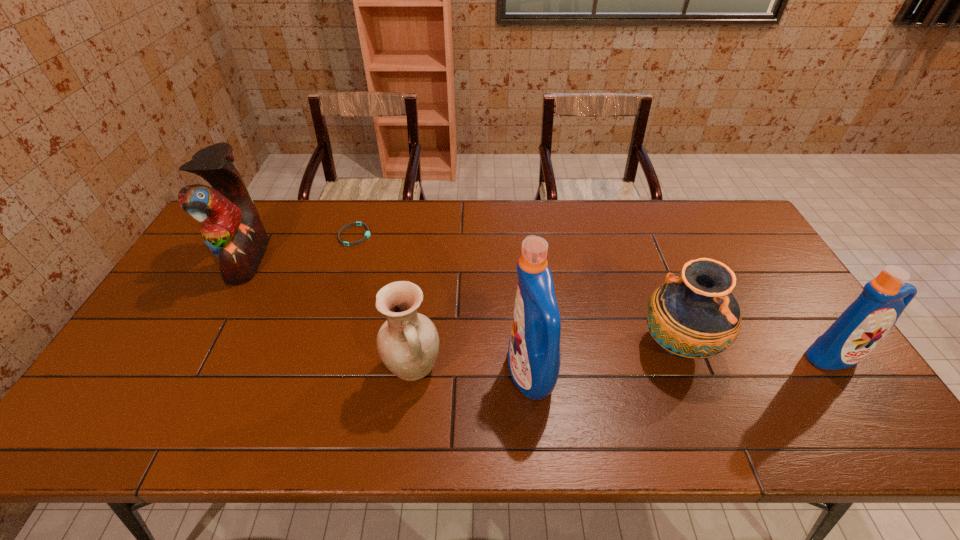
You are a GUI agent. You are given a task and a screenshot of the screen. Output one action in this format:
    pyautogui.click(x=<x>, y=<y>)
    Task: Click on the vacant position located on the label of the fourth object from left to right
    This screenshot has width=960, height=540.
    Given the screenshot: What is the action you would take?
    pyautogui.click(x=375, y=374)

Find the location of a particular element. free location located 0.290m on the label of the fourth object from left to right is located at coordinates (392, 374).

This screenshot has width=960, height=540. What are the coordinates of `free spot located on the label of the shorter detergent` in the screenshot? It's located at [857, 389].

Where is `free region located 0.390m at the face of the leftmost object`? This screenshot has height=540, width=960. free region located 0.390m at the face of the leftmost object is located at coordinates (389, 259).

This screenshot has height=540, width=960. Find the location of `free spot located 0.230m on the buckle of the wristband`. free spot located 0.230m on the buckle of the wristband is located at coordinates (440, 235).

The height and width of the screenshot is (540, 960). I want to click on free spot located on the back of the left pottery, so click(421, 302).

The width and height of the screenshot is (960, 540). I want to click on vacant space located on the left of the second object from right to left, so click(x=546, y=346).

Locate an element on the screen. parrot at the far edge is located at coordinates (231, 227).

Where is `wristband situated at the far edge`? The width and height of the screenshot is (960, 540). wristband situated at the far edge is located at coordinates (367, 234).

Locate an element on the screen. The height and width of the screenshot is (540, 960). object present at the left edge is located at coordinates pos(231,227).